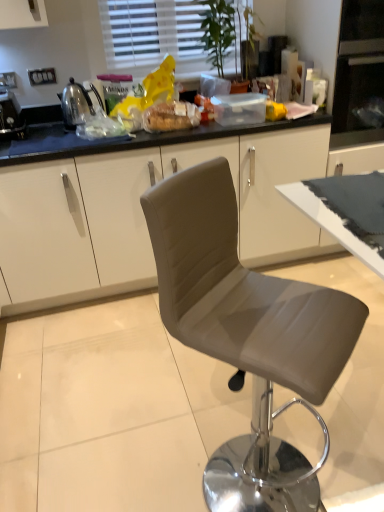
Question: From a real-world perspective, is translucent plastic bread at center beneath satin grey chair at center?

Choices:
 (A) no
 (B) yes

Answer: (A)

Question: Could you tell me if translucent plastic bread at center is turned towards satin grey chair at center?

Choices:
 (A) no
 (B) yes

Answer: (A)

Question: From the image's perspective, would you say translucent plastic bread at center is shown under satin grey chair at center?

Choices:
 (A) no
 (B) yes

Answer: (A)

Question: Is translucent plastic bread at center outside satin grey chair at center?

Choices:
 (A) yes
 (B) no

Answer: (A)

Question: Considering the relative sizes of translucent plastic bread at center and satin grey chair at center in the image provided, is translucent plastic bread at center thinner than satin grey chair at center?

Choices:
 (A) no
 (B) yes

Answer: (B)

Question: In terms of size, does white blinds at upper center appear bigger or smaller than translucent plastic bread at center?

Choices:
 (A) big
 (B) small

Answer: (A)

Question: Looking at their shapes, would you say white blinds at upper center is wider or thinner than translucent plastic bread at center?

Choices:
 (A) wide
 (B) thin

Answer: (B)

Question: From the image's perspective, is white blinds at upper center positioned above or below translucent plastic bread at center?

Choices:
 (A) below
 (B) above

Answer: (B)

Question: Is point (122, 31) positioned closer to the camera than point (198, 115)?

Choices:
 (A) farther
 (B) closer

Answer: (A)

Question: Considering the relative positions of shiny metallic kettle at left, marked as the 1th appliance in a right-to-left arrangement, and translucent plastic bread at center in the image provided, is shiny metallic kettle at left, marked as the 1th appliance in a right-to-left arrangement, to the left or to the right of translucent plastic bread at center?

Choices:
 (A) left
 (B) right

Answer: (A)

Question: Is shiny metallic kettle at left, marked as the 1th appliance in a right-to-left arrangement, inside the boundaries of translucent plastic bread at center, or outside?

Choices:
 (A) outside
 (B) inside

Answer: (A)

Question: From a real-world perspective, relative to translucent plastic bread at center, is shiny metallic kettle at left, marked as the 1th appliance in a right-to-left arrangement, vertically above or below?

Choices:
 (A) below
 (B) above

Answer: (B)

Question: Looking at the image, does shiny metallic kettle at left, which is counted as the second appliance, starting from the left, seem bigger or smaller compared to translucent plastic bread at center?

Choices:
 (A) big
 (B) small

Answer: (A)

Question: Is point (130, 31) closer or farther from the camera than point (82, 100)?

Choices:
 (A) farther
 (B) closer

Answer: (A)

Question: Considering their positions, is white blinds at upper center located in front of or behind shiny metallic kettle at left, which is counted as the second appliance, starting from the left?

Choices:
 (A) behind
 (B) front

Answer: (A)